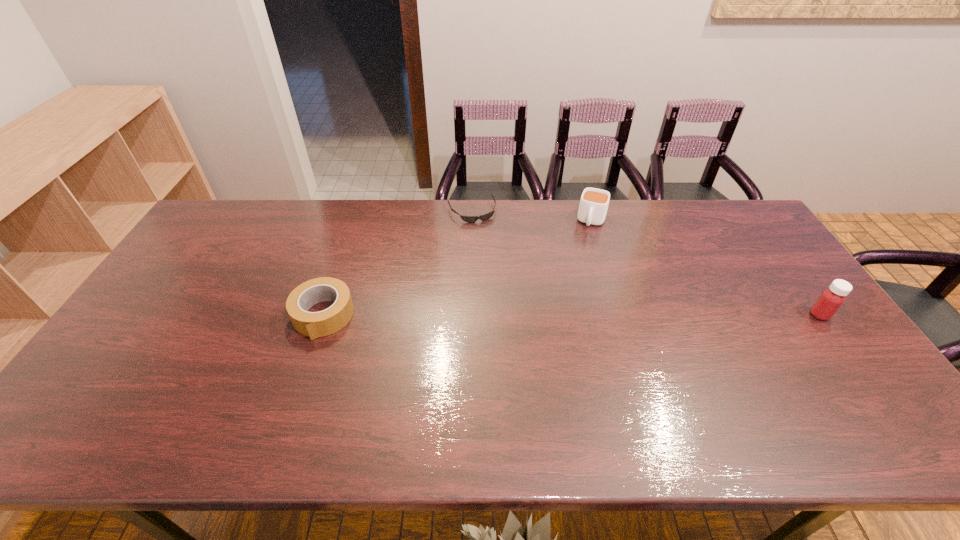
Where is `blank area located on the side with the handle of the second object from right to left`? Image resolution: width=960 pixels, height=540 pixels. blank area located on the side with the handle of the second object from right to left is located at coordinates (566, 306).

The width and height of the screenshot is (960, 540). I want to click on vacant space located 0.270m on the side with the handle of the second object from right to left, so click(x=573, y=285).

I want to click on free space located on the side with the handle of the second object from right to left, so click(x=573, y=285).

Locate an element on the screen. This screenshot has width=960, height=540. free space located 0.290m on the front-facing side of the shortest object is located at coordinates (502, 278).

Where is `free spot located 0.120m on the front-facing side of the shortest object`? free spot located 0.120m on the front-facing side of the shortest object is located at coordinates (487, 244).

Locate an element on the screen. This screenshot has width=960, height=540. vacant point located 0.070m on the front-facing side of the shortest object is located at coordinates (483, 235).

The height and width of the screenshot is (540, 960). In order to click on cup located in the far edge section of the desktop in this screenshot , I will do `click(593, 206)`.

Locate an element on the screen. Image resolution: width=960 pixels, height=540 pixels. sunglasses that is at the far edge is located at coordinates (470, 219).

At what (x,y) coordinates should I click in order to perform the action: click on object that is at the right edge. Please return your answer as a coordinate pair (x, y). This screenshot has width=960, height=540. Looking at the image, I should click on (831, 299).

This screenshot has height=540, width=960. I want to click on vacant space at the far edge of the desktop, so click(x=278, y=211).